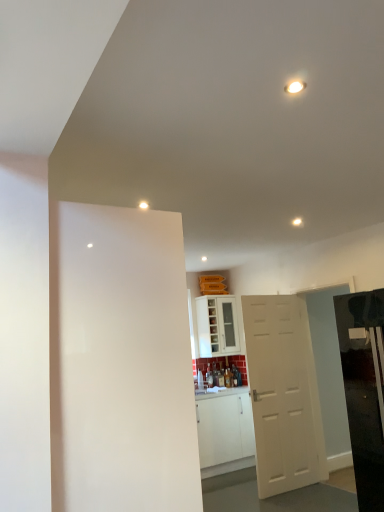
Question: Is white glossy light at upper center positioned with its back to glossy black refrigerator at right?

Choices:
 (A) no
 (B) yes

Answer: (A)

Question: Is white glossy light at upper center at the right side of glossy black refrigerator at right?

Choices:
 (A) no
 (B) yes

Answer: (A)

Question: From a real-world perspective, is white glossy light at upper center located higher than glossy black refrigerator at right?

Choices:
 (A) no
 (B) yes

Answer: (B)

Question: Is the depth of white glossy light at upper center greater than that of glossy black refrigerator at right?

Choices:
 (A) yes
 (B) no

Answer: (A)

Question: Does white glossy light at upper center have a greater height compared to glossy black refrigerator at right?

Choices:
 (A) yes
 (B) no

Answer: (B)

Question: Does point (359, 500) appear closer or farther from the camera than point (140, 441)?

Choices:
 (A) closer
 (B) farther

Answer: (B)

Question: Looking at the image, does glossy black refrigerator at right seem bigger or smaller compared to white matte door at left, which is the 2th door from right to left?

Choices:
 (A) small
 (B) big

Answer: (B)

Question: Is glossy black refrigerator at right taller or shorter than white matte door at left, the 1th door positioned from the left?

Choices:
 (A) tall
 (B) short

Answer: (A)

Question: From the image's perspective, relative to white matte door at left, which appears as the first door when viewed from the front, is glossy black refrigerator at right above or below?

Choices:
 (A) below
 (B) above

Answer: (A)

Question: In terms of width, does white matte door at left, which is the 2th door from right to left, look wider or thinner when compared to white matte door at center, arranged as the second door when viewed from the left?

Choices:
 (A) wide
 (B) thin

Answer: (A)

Question: Visually, is white matte door at left, which is the 2th door from right to left, positioned to the left or to the right of white matte door at center, the second door positioned from the front?

Choices:
 (A) left
 (B) right

Answer: (A)

Question: From the image's perspective, relative to white matte door at center, the second door positioned from the front, is white matte door at left, which is the 2th door from right to left, above or below?

Choices:
 (A) below
 (B) above

Answer: (B)

Question: Considering the positions of white matte door at left, the 2th door positioned from the back, and white matte door at center, the second door positioned from the front, in the image, is white matte door at left, the 2th door positioned from the back, taller or shorter than white matte door at center, the second door positioned from the front,?

Choices:
 (A) short
 (B) tall

Answer: (A)

Question: From a real-world perspective, is white glossy light at upper center physically located above or below white matte door at center, positioned as the 1th door in back-to-front order?

Choices:
 (A) above
 (B) below

Answer: (A)

Question: Is white glossy light at upper center in front of or behind white matte door at center, positioned as the 1th door in back-to-front order, in the image?

Choices:
 (A) front
 (B) behind

Answer: (A)